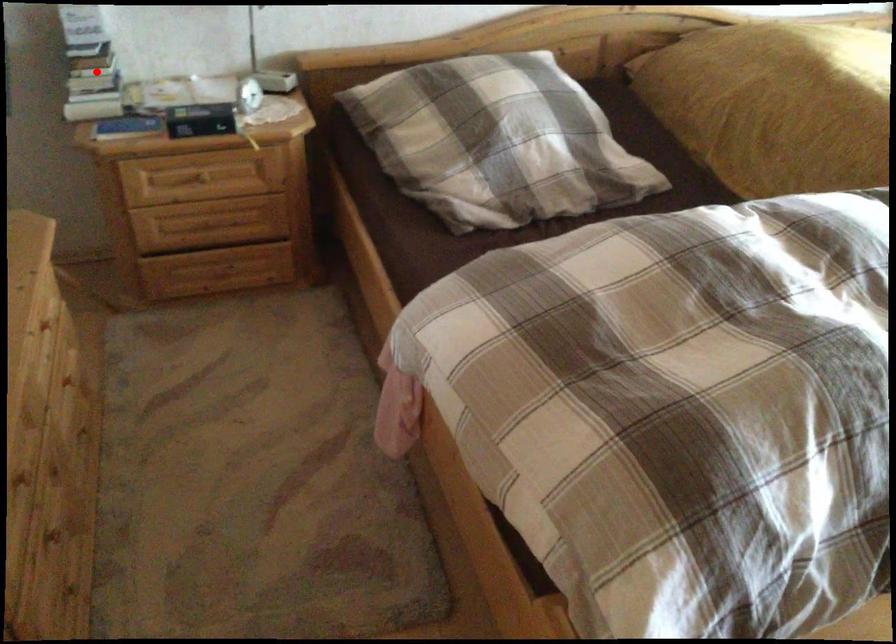
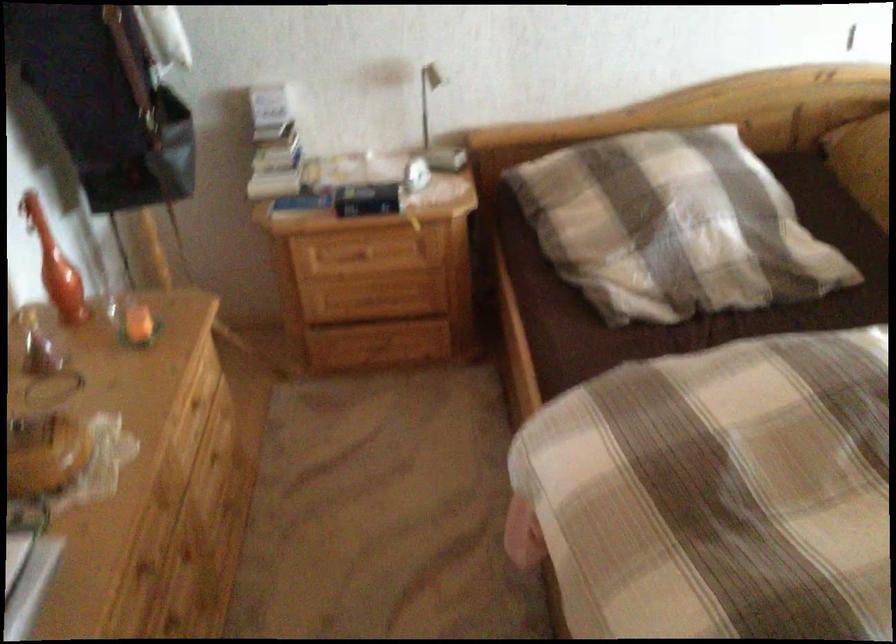
Find the pixel in the second image that matches the highlighted location in the first image.

(276, 145)